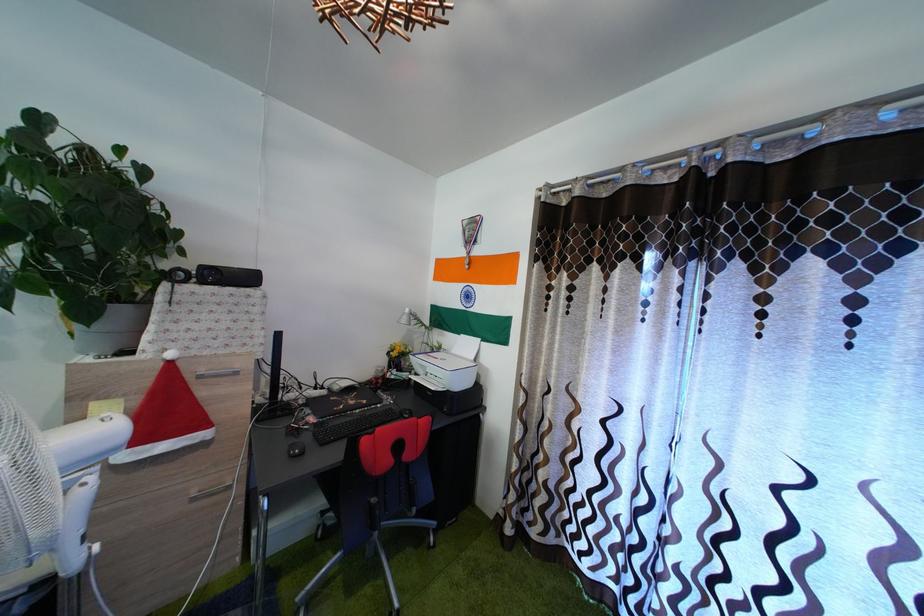
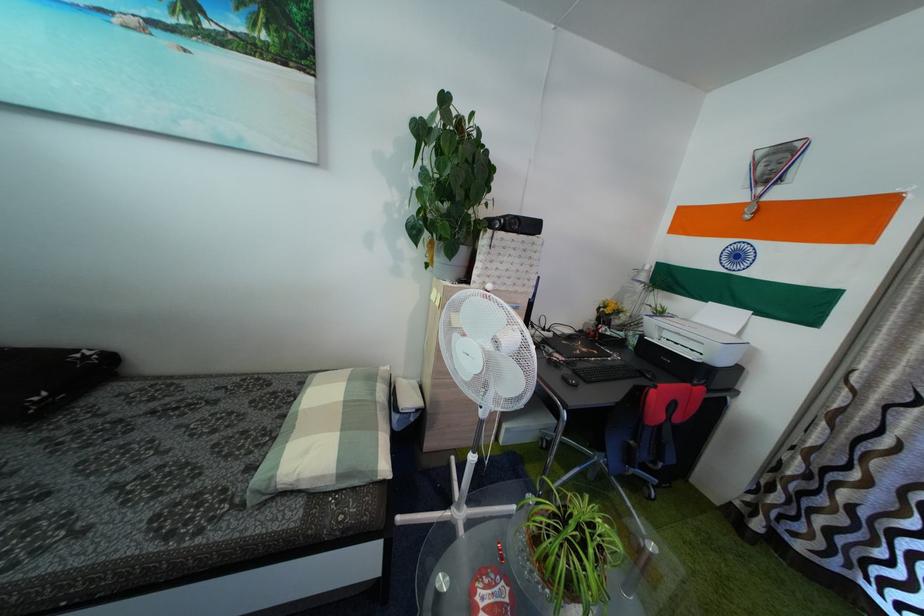
Find the pixel in the second image that matches [315,445] in the first image.

(575, 379)